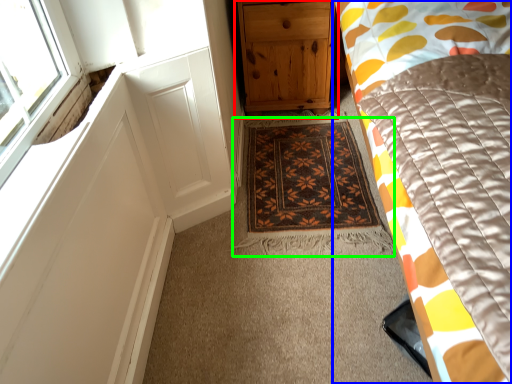
Question: Which object is positioned farthest from chest of drawers (highlighted by a red box)? Select from bed (highlighted by a blue box) and mat (highlighted by a green box).

Choices:
 (A) bed
 (B) mat

Answer: (A)